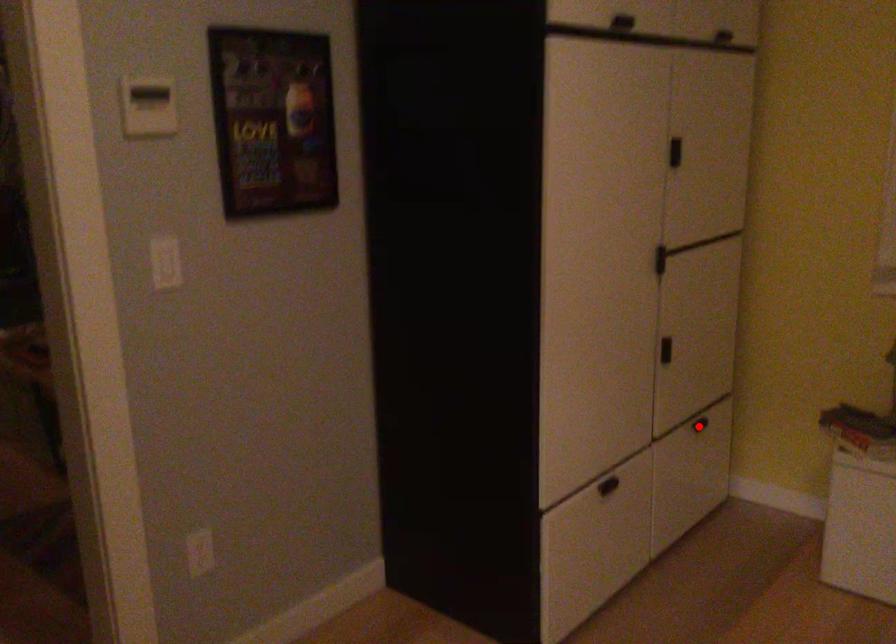
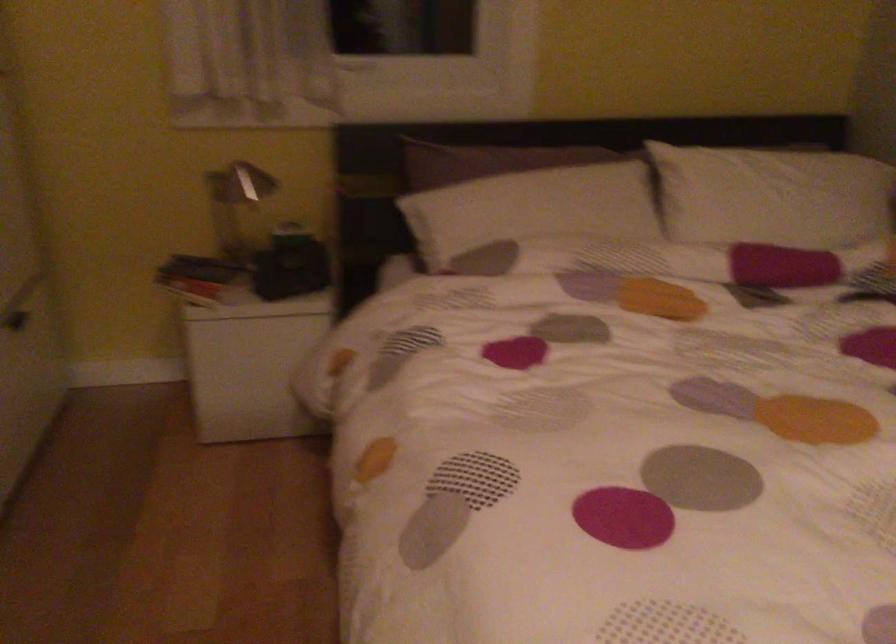
Find the pixel in the second image that matches the highlighted location in the first image.

(21, 323)